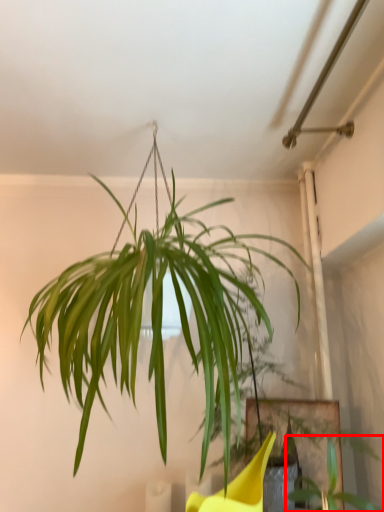
Question: Considering the relative positions of plant (annotated by the red box) and houseplant in the image provided, where is plant (annotated by the red box) located with respect to the staircase?

Choices:
 (A) right
 (B) left

Answer: (A)